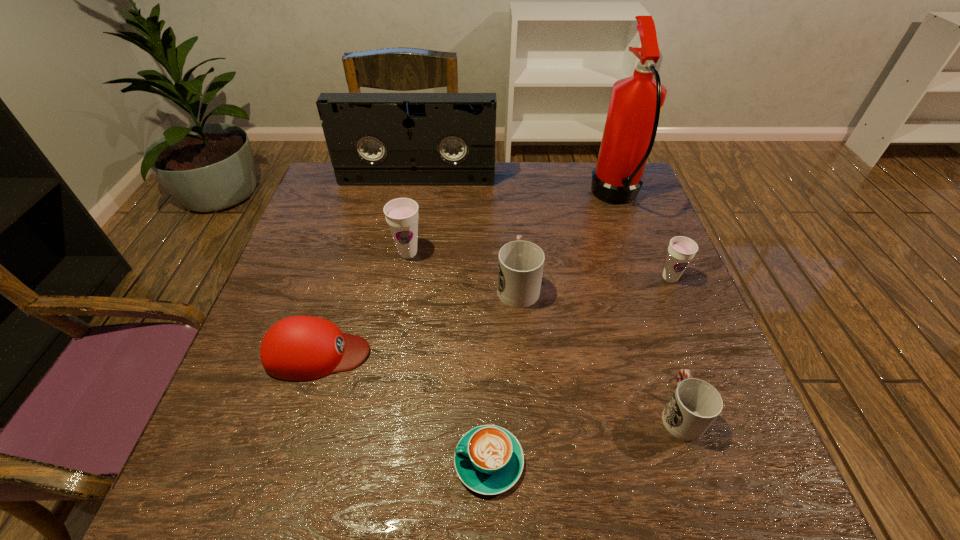
This screenshot has width=960, height=540. I want to click on free space that is in between the farther red cup and the fire extinguisher, so click(567, 241).

Find the location of a particular element. unoccupied area between the videotape and the tallest object is located at coordinates (516, 188).

Image resolution: width=960 pixels, height=540 pixels. Find the location of `vacant area that lies between the third nearest object and the bigger purple cup`. vacant area that lies between the third nearest object and the bigger purple cup is located at coordinates (363, 303).

This screenshot has height=540, width=960. Identify the location of vacant area that lies between the nearest cup and the third tallest object. (544, 333).

Identify which object is the fourth nearest to the right red cup. Please provide its 2D coordinates. Your answer should be formatted as a tuple, i.e. [(x, y)], where the tuple contains the x and y coordinates of a point satisfying the conditions above.

[(636, 102)]

Where is `object that stands as the fifth closest to the third tallest object`? object that stands as the fifth closest to the third tallest object is located at coordinates [x=636, y=102].

Image resolution: width=960 pixels, height=540 pixels. In order to click on the second closest cup to the sixth farthest object in this screenshot , I will do `click(520, 265)`.

Locate an element on the screen. cup that is the closest to the shortest cup is located at coordinates (681, 250).

Identify the location of vacant region that satisfies the following two spatial constraints: 1. on the side of the videotape with visible spindles; 2. on the left side of the farther purple cup. (404, 253).

Locate an element on the screen. vacant space that satisfies the following two spatial constraints: 1. on the handle side of the smaller purple cup; 2. on the left side of the smaller red cup is located at coordinates (635, 278).